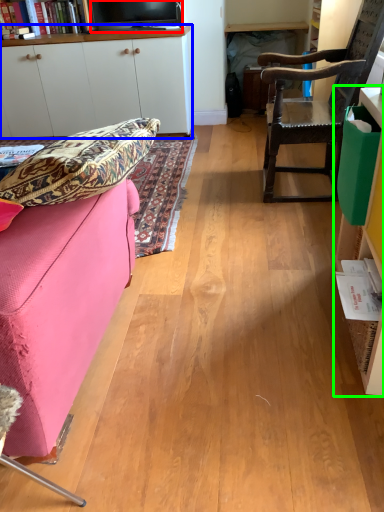
Question: Estimate the real-world distances between objects in this image. Which object is closer to television (highlighted by a red box), cabinetry (highlighted by a blue box) or cabinetry (highlighted by a green box)?

Choices:
 (A) cabinetry
 (B) cabinetry

Answer: (A)